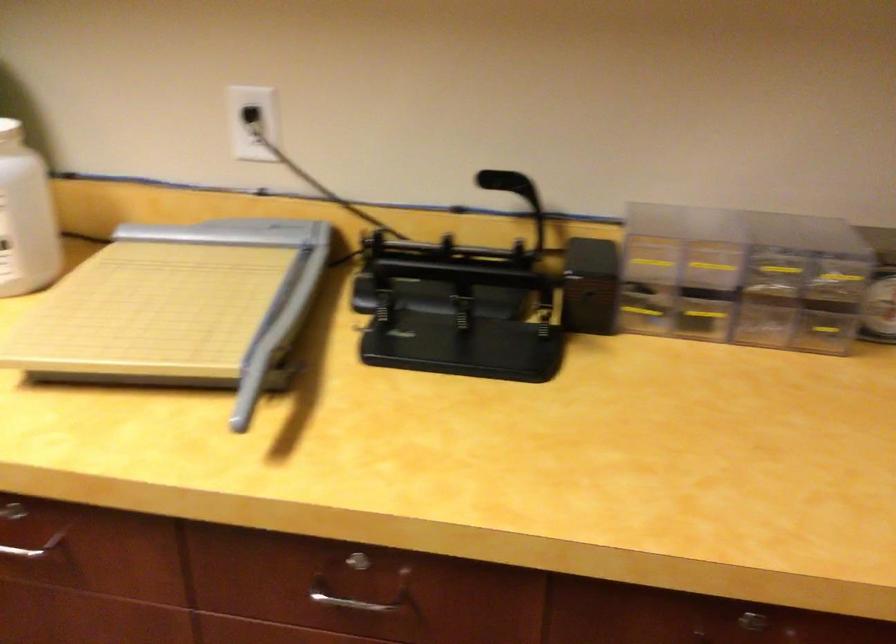
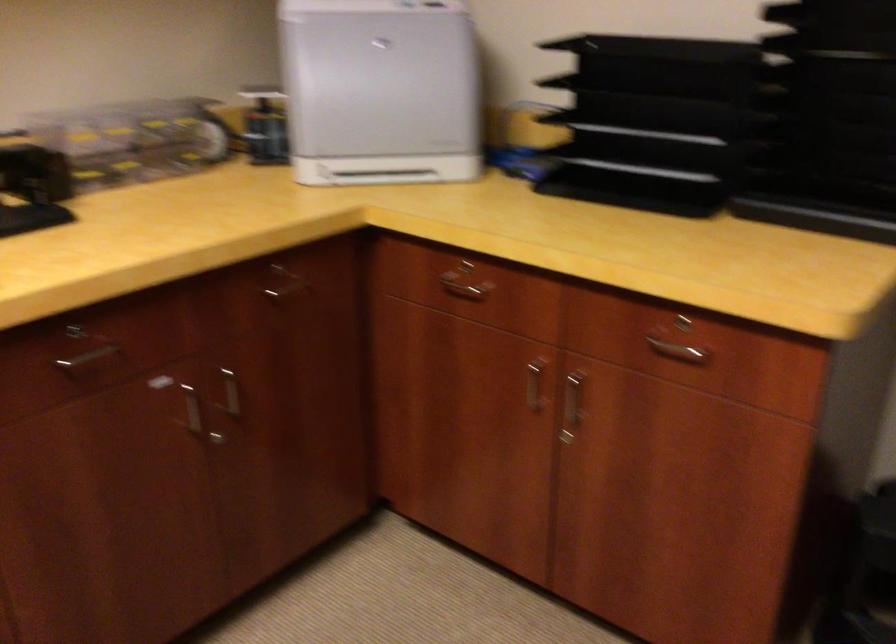
Question: Based on the continuous images, in which direction is the camera rotating? Reply with the corresponding letter.

Choices:
 (A) Left
 (B) Right
 (C) Up
 (D) Down

Answer: (B)